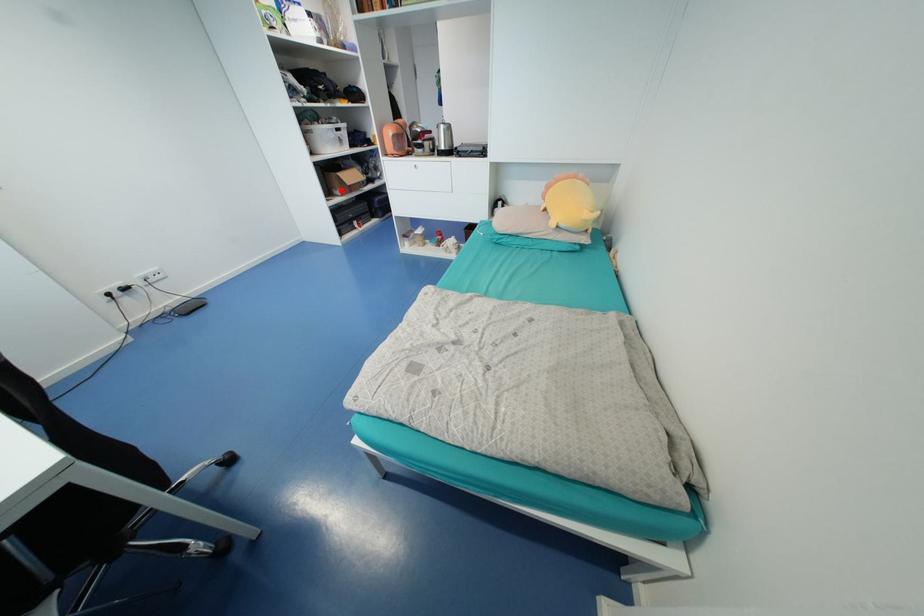
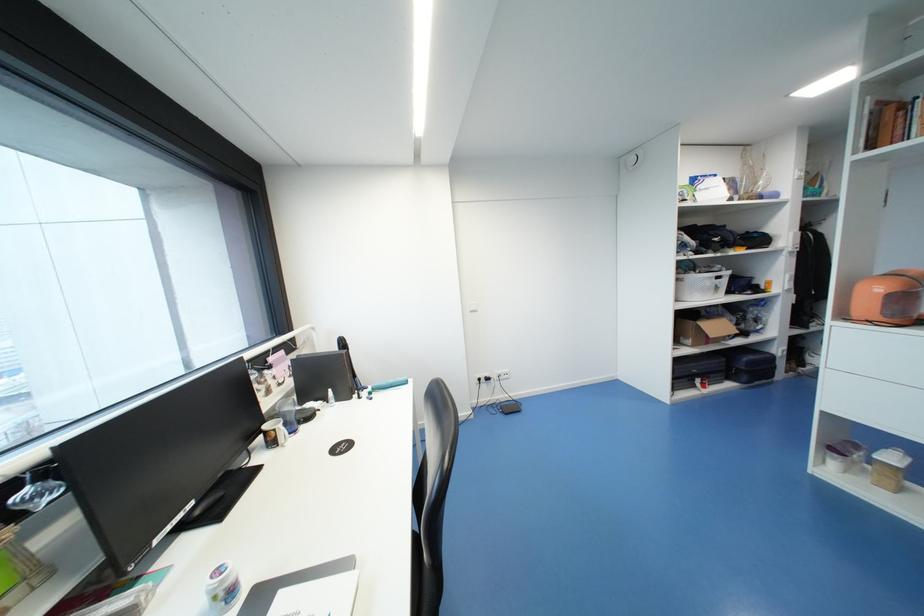
In the second image, find the point that corresponds to the highlighted location in the first image.

(690, 339)